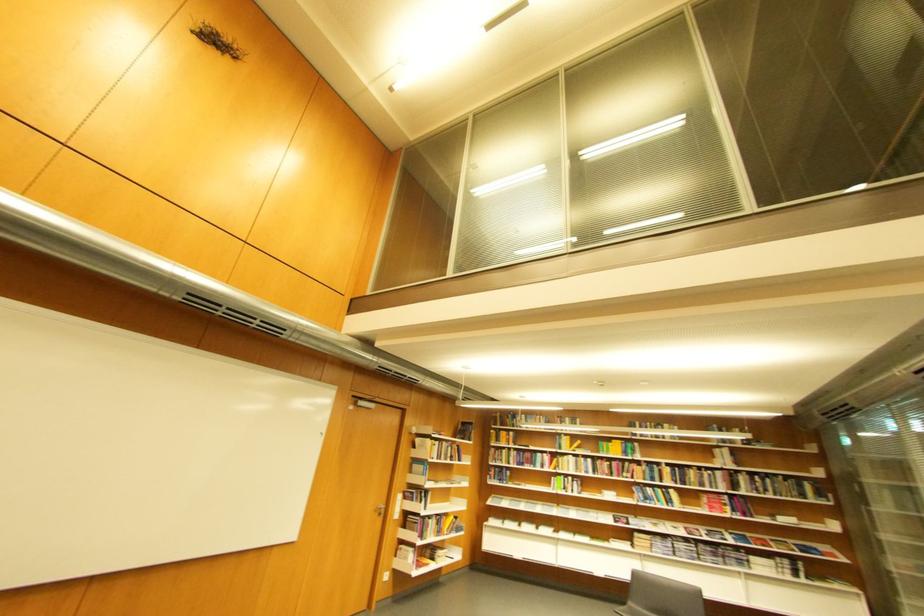
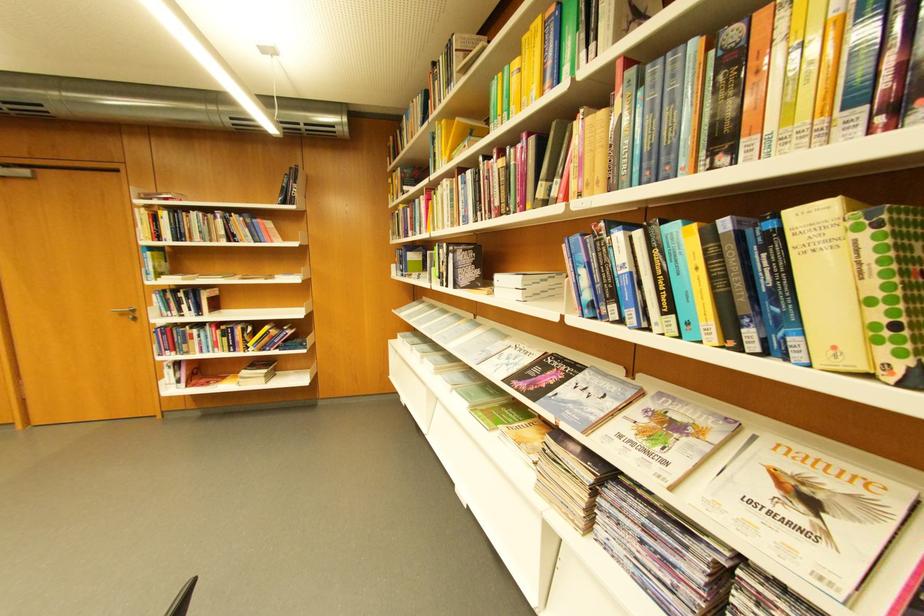
Locate, in the second image, the point that corresponds to (626,523) in the first image.

(532, 377)